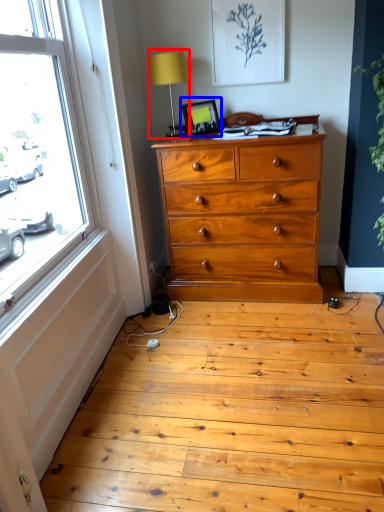
Question: Which point is closer to the camera, table lamp (highlighted by a red box) or picture frame (highlighted by a blue box)?

Choices:
 (A) table lamp
 (B) picture frame

Answer: (A)